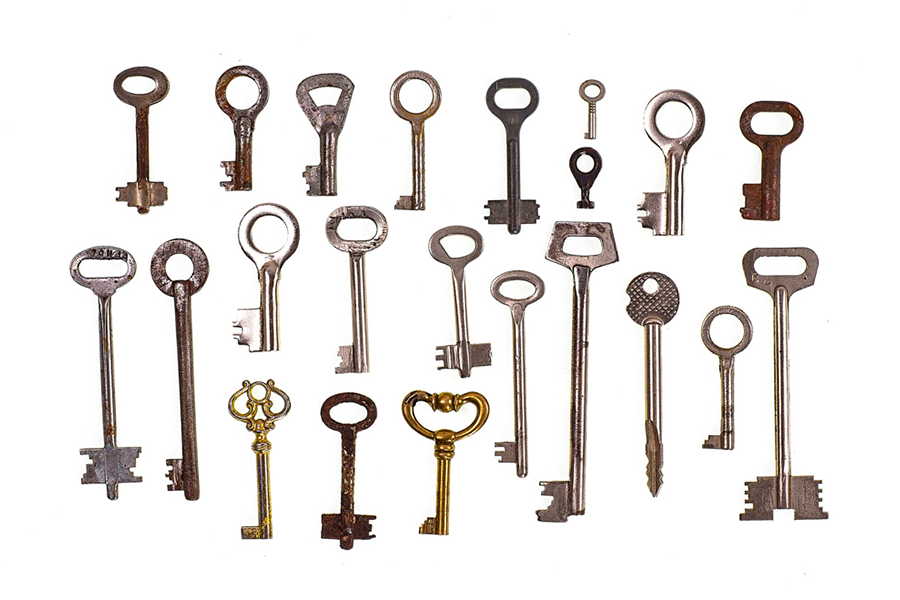
Where is `bronze keys`? The width and height of the screenshot is (900, 600). bronze keys is located at coordinates (146, 123), (241, 131), (771, 169), (189, 347), (344, 485).